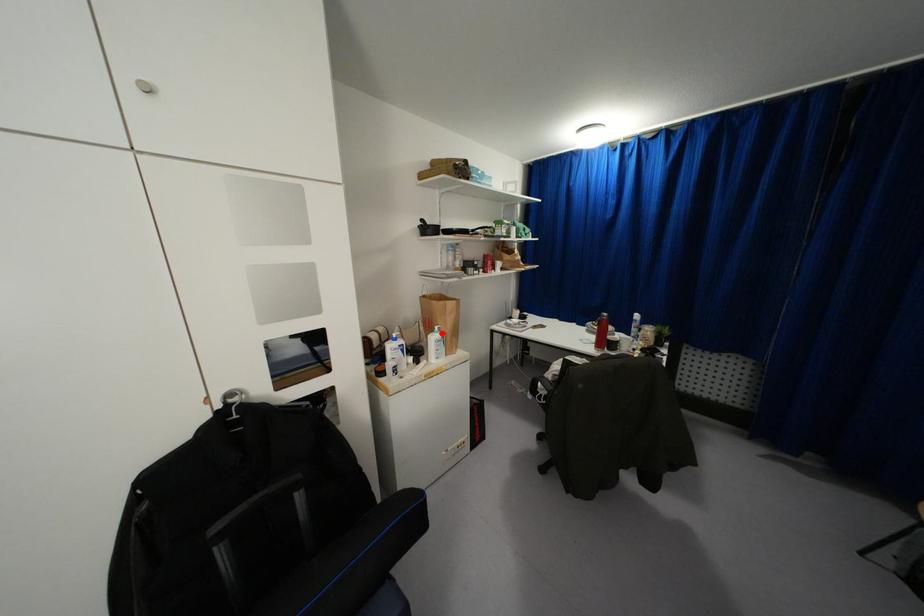
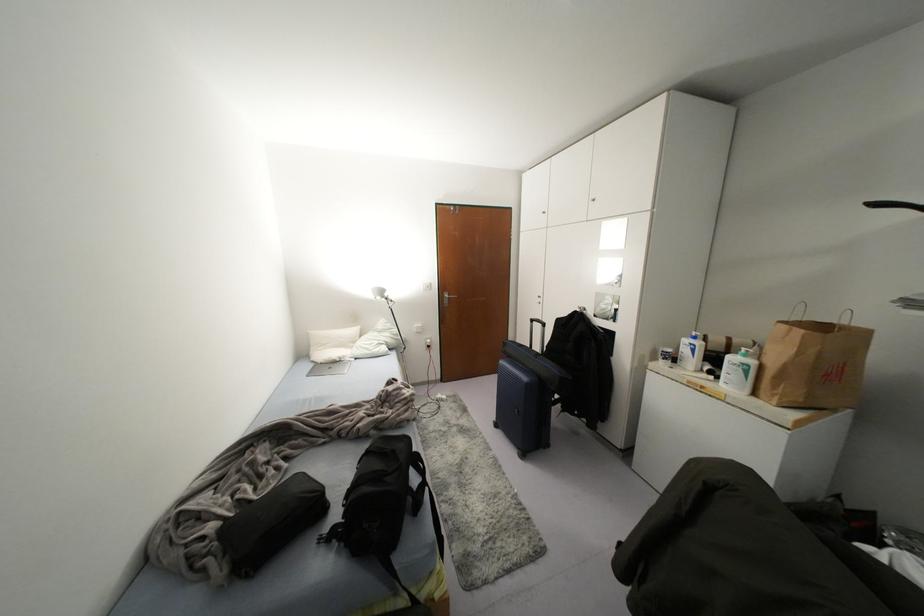
In the second image, find the point that corresponds to the highlighted location in the first image.

(751, 362)